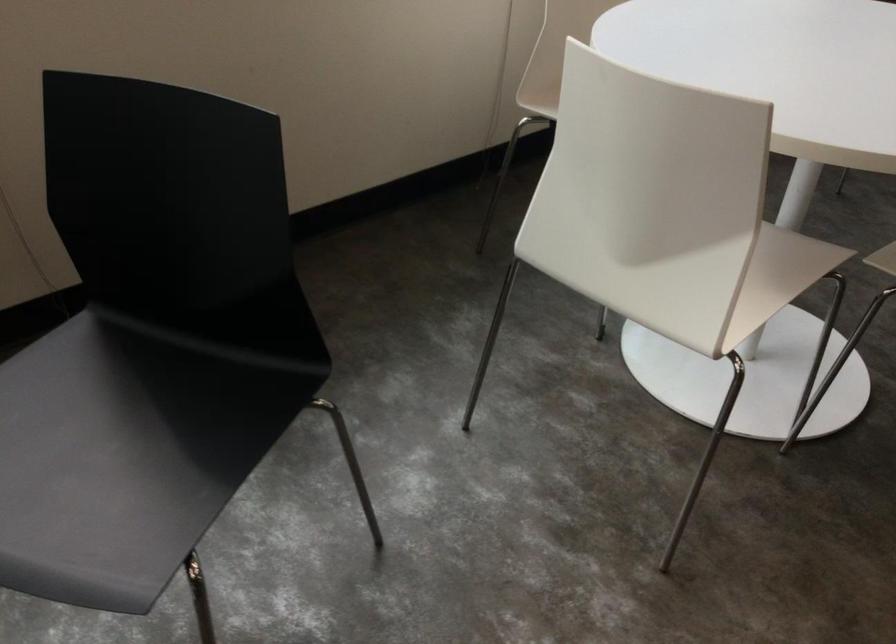
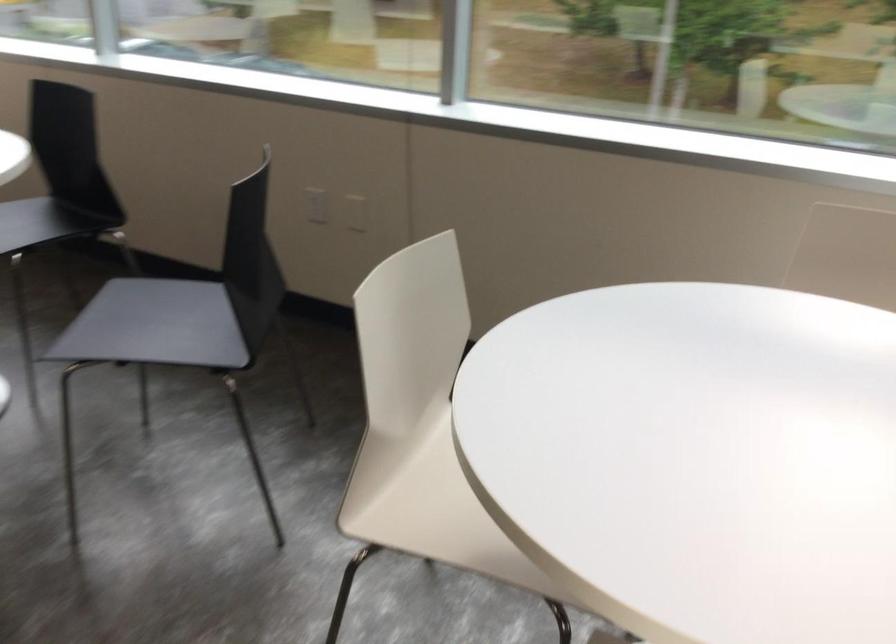
In the second image, find the point that corresponds to (702,288) in the first image.

(431, 509)